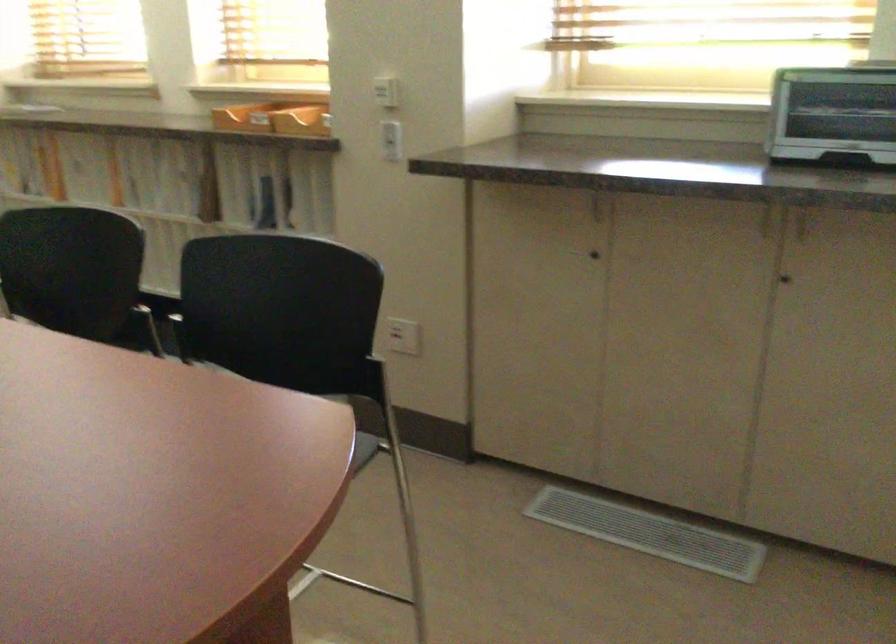
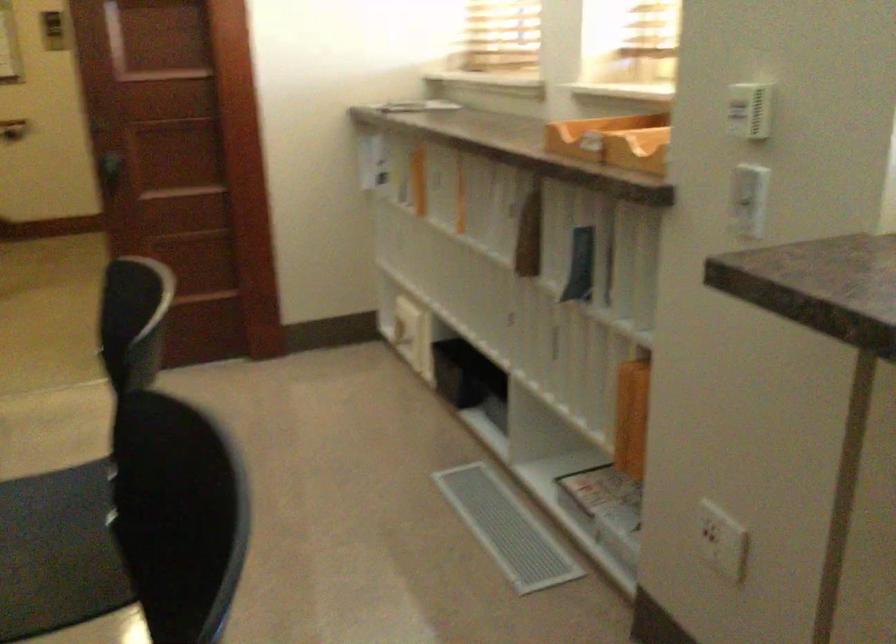
The point at (409, 330) is marked in the first image. Where is the corresponding point in the second image?

(721, 541)